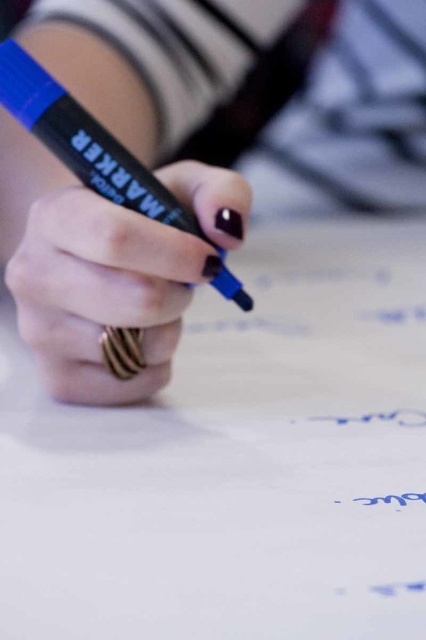
You are an artist who needs to choose between the blue marker at center and the matte black marker at center for a project that requires a taller marker. Which one should you pick?

The blue marker at center is much taller than the matte black marker at center, so you should pick the blue marker at center for your project.

You are trying to reach for the matte black marker at center while holding the blue marker at center. Can you easily access it without moving your hand?

The blue marker at center is closer to you than the matte black marker at center, so you would need to move your hand to reach the matte black marker at center.

You are an artist trying to choose between the blue marker at center and the matte black marker at center. Which one is positioned to the right side?

The blue marker at center is positioned to the right of the matte black marker at center, so the blue marker at center is on the right side.